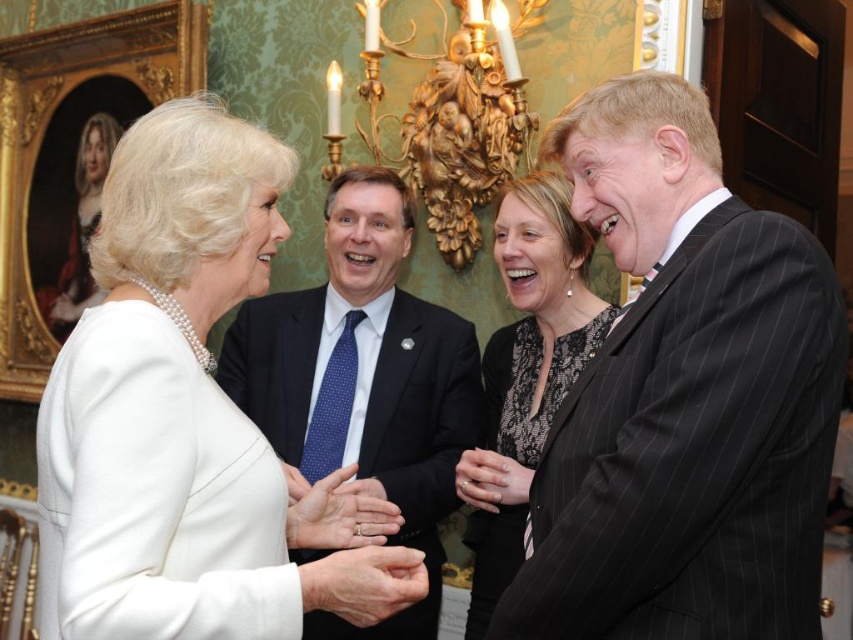
You are a photographer setting up for a group photo. You need to ensure that the black lace dress at center and the white matte ring at center are both visible in the frame. Based on their positions, which object should you adjust your camera to focus on first to capture both?

The black lace dress at center is positioned on the right side of the white matte ring at center. To capture both in the frame, focus on the white matte ring at center first as it is on the left, ensuring the dress on the right remains within the shot.

You are a photographer setting up for a formal event. You need to ensure that the black lace dress at center and the white matte ring at center are both visible in the frame. Given their sizes, which object will require a closer focus to capture details?

The white matte ring at center is smaller in width compared to the black lace dress at center, so it will require closer focus to capture its details.